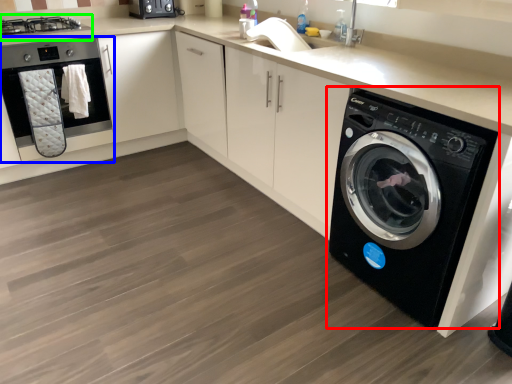
Question: Which is nearer to the washing machine (highlighted by a red box)? home appliance (highlighted by a blue box) or stove (highlighted by a green box).

Choices:
 (A) home appliance
 (B) stove

Answer: (A)